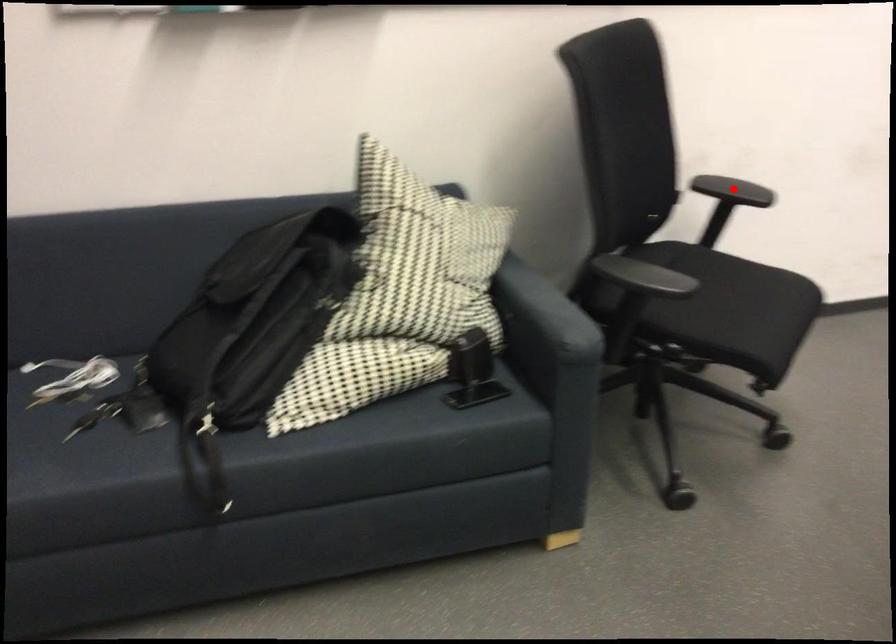
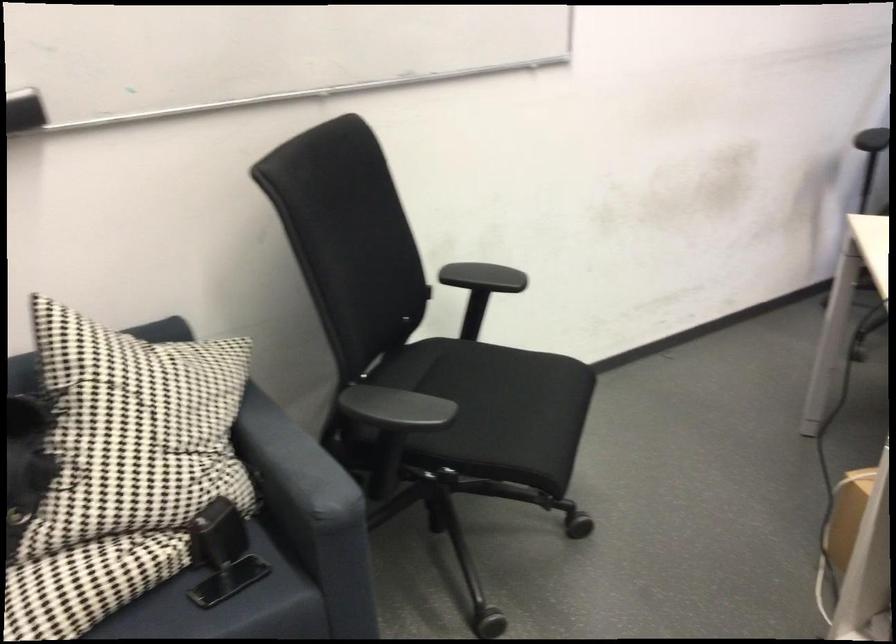
In the second image, find the point that corresponds to the highlighted location in the first image.

(483, 277)